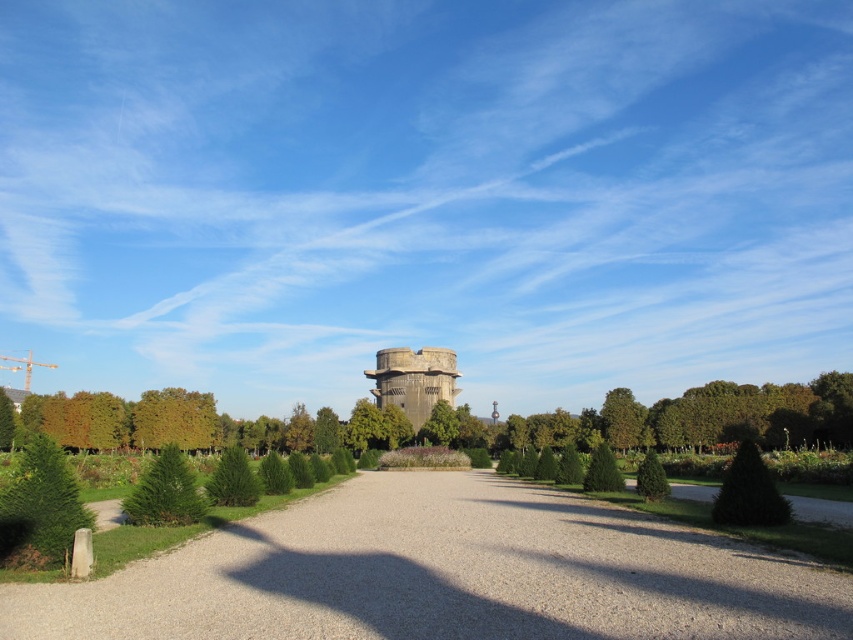
Is point (48, 497) closer to viewer compared to point (456, 355)?

Yes, point (48, 497) is closer to viewer.

Can you confirm if green leafy bush at lower left is positioned above gray concrete water tower at center?

Yes.

Between point (26, 548) and point (409, 371), which one is positioned in front?

Point (26, 548) is in front.

Where is `green leafy bush at lower left`? green leafy bush at lower left is located at coordinates (39, 509).

Can you confirm if gray concrete water tower at center is bigger than green leafy tree at center?

Yes.

Is point (399, 381) closer to camera compared to point (634, 410)?

That is False.

The width and height of the screenshot is (853, 640). Describe the element at coordinates (415, 380) in the screenshot. I see `gray concrete water tower at center` at that location.

Where is `gray concrete water tower at center`? gray concrete water tower at center is located at coordinates (415, 380).

Which is more to the right, green leafy tree at center or green textured bush at center-right?

green leafy tree at center is more to the right.

Does green leafy tree at center appear on the right side of green textured bush at center-right?

Correct, you'll find green leafy tree at center to the right of green textured bush at center-right.

Who is more forward, (618,388) or (650,480)?

Point (650,480) is in front.

At what (x,y) coordinates should I click in order to perform the action: click on green leafy tree at center. Please return your answer as a coordinate pair (x, y). Looking at the image, I should click on (622, 419).